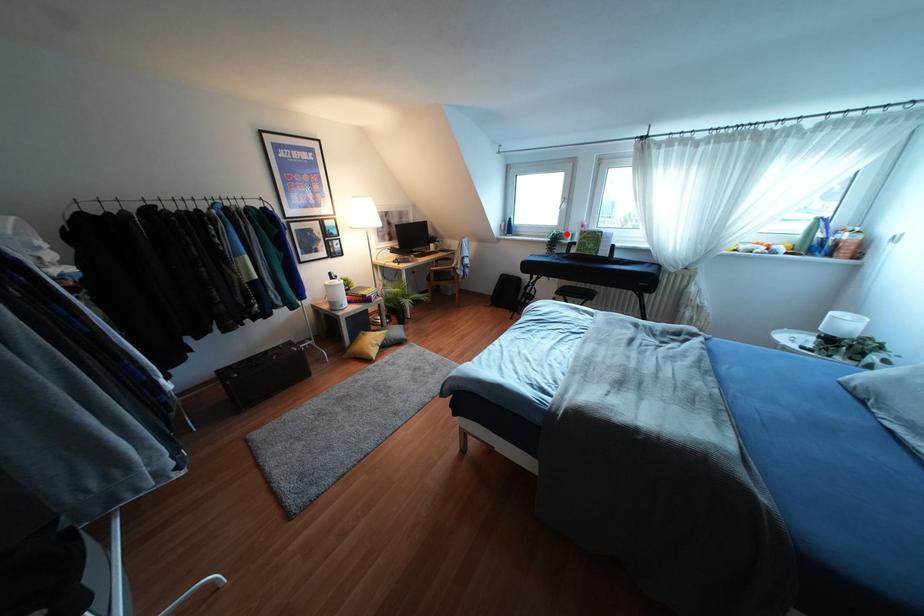
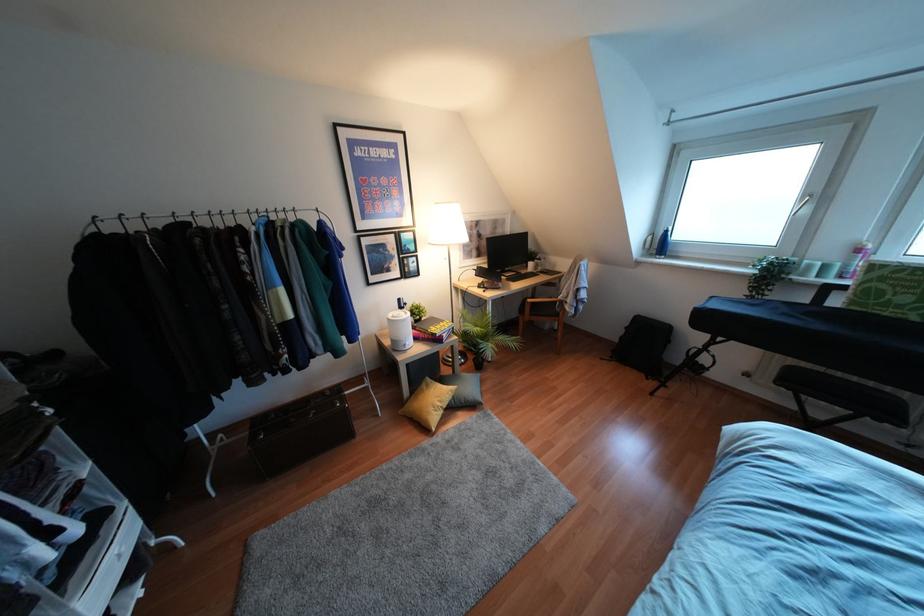
Question: I am providing you with two images of the same scene from different viewpoints. Given a red point in image1, look at the same physical point in image2. Is it:

Choices:
 (A) Closer to the viewpoint
 (B) Farther from the viewpoint

Answer: (B)